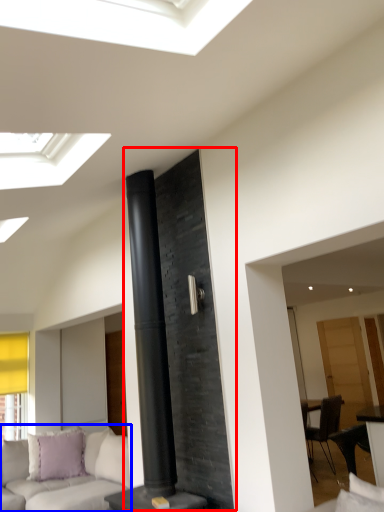
Question: Which object appears closest to the camera in this image, fireplace (highlighted by a red box) or studio couch (highlighted by a blue box)?

Choices:
 (A) fireplace
 (B) studio couch

Answer: (A)